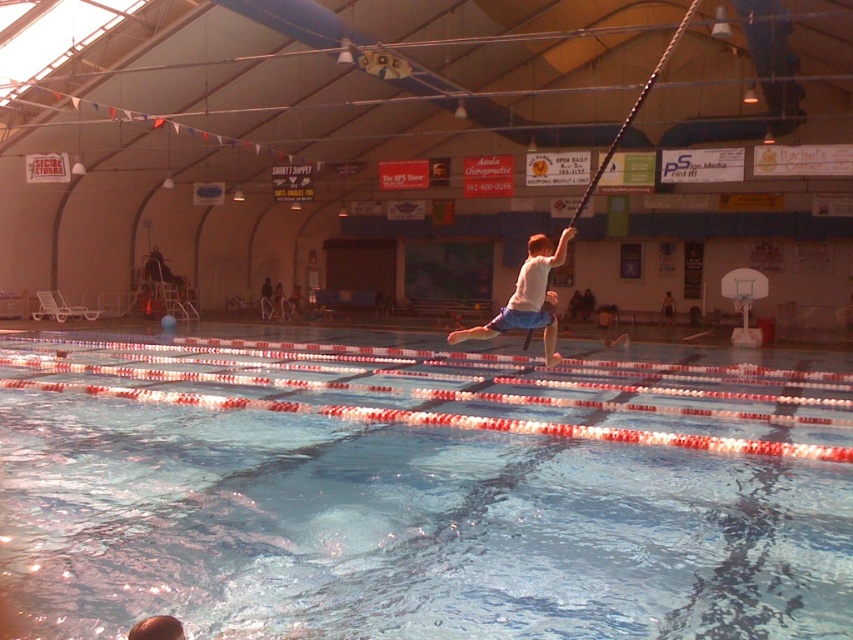
Question: Which of the following is the closest to the observer?

Choices:
 (A) [x=666, y=310]
 (B) [x=1, y=394]

Answer: (B)

Question: Is white matte shirt at center positioned in front of light brown shorts at center?

Choices:
 (A) yes
 (B) no

Answer: (A)

Question: Considering the real-world distances, which object is farthest from the clear blue water at center?

Choices:
 (A) light brown shorts at center
 (B) white matte shirt at center

Answer: (A)

Question: Among these points, which one is nearest to the camera?

Choices:
 (A) (805, 476)
 (B) (509, 316)

Answer: (A)

Question: From the image, what is the correct spatial relationship of white matte shirt at center in relation to light brown shorts at center?

Choices:
 (A) right
 (B) left

Answer: (B)

Question: Does white matte shirt at center have a larger size compared to light brown shorts at center?

Choices:
 (A) no
 (B) yes

Answer: (B)